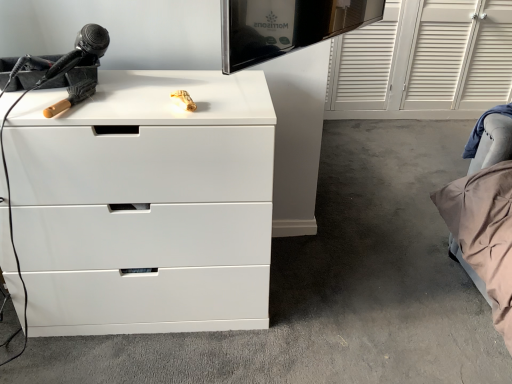
Question: Is white glossy dresser at center inside the boundaries of white glossy chest of drawers at upper left, or outside?

Choices:
 (A) outside
 (B) inside

Answer: (A)

Question: From the image's perspective, is white glossy dresser at center positioned above or below white glossy chest of drawers at upper left?

Choices:
 (A) above
 (B) below

Answer: (A)

Question: Looking at the image, does white glossy dresser at center seem bigger or smaller compared to white glossy chest of drawers at upper left?

Choices:
 (A) big
 (B) small

Answer: (A)

Question: Considering their positions, is white glossy chest of drawers at upper left located in front of or behind white glossy dresser at center?

Choices:
 (A) behind
 (B) front

Answer: (B)

Question: Considering the relative positions of white glossy chest of drawers at upper left and white glossy dresser at center in the image provided, is white glossy chest of drawers at upper left to the left or to the right of white glossy dresser at center?

Choices:
 (A) right
 (B) left

Answer: (B)

Question: From the image's perspective, relative to white glossy dresser at center, is white glossy chest of drawers at upper left above or below?

Choices:
 (A) below
 (B) above

Answer: (A)

Question: Is point tap(100, 183) positioned closer to the camera than point tap(323, 150)?

Choices:
 (A) farther
 (B) closer

Answer: (B)